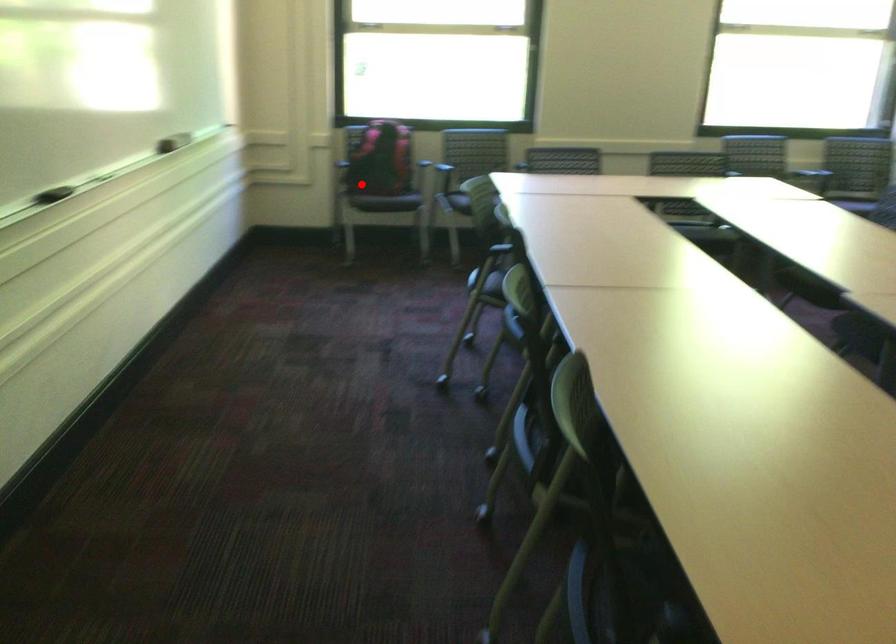
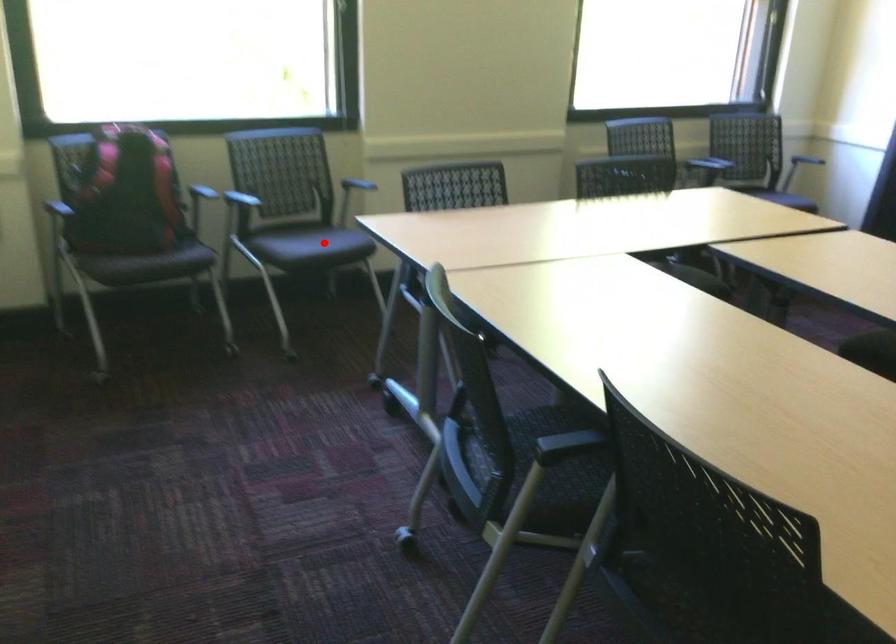
I am providing you with two images of the same scene from different viewpoints. A red point is marked on the first image and another point is marked on the second image. Are the points marked in image1 and image2 representing the same 3D position?

No